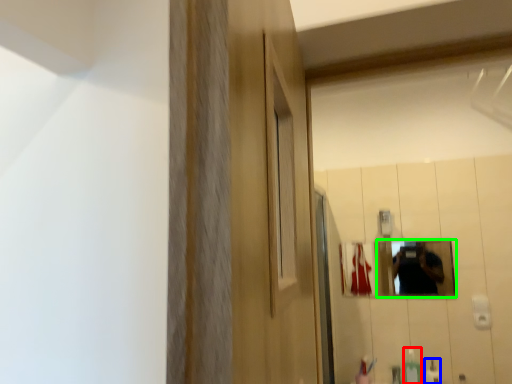
Question: Based on their relative distances, which object is nearer to soap dispenser (highlighted by a red box)? Choose from mouthwash (highlighted by a blue box) and mirror (highlighted by a green box).

Choices:
 (A) mouthwash
 (B) mirror

Answer: (A)